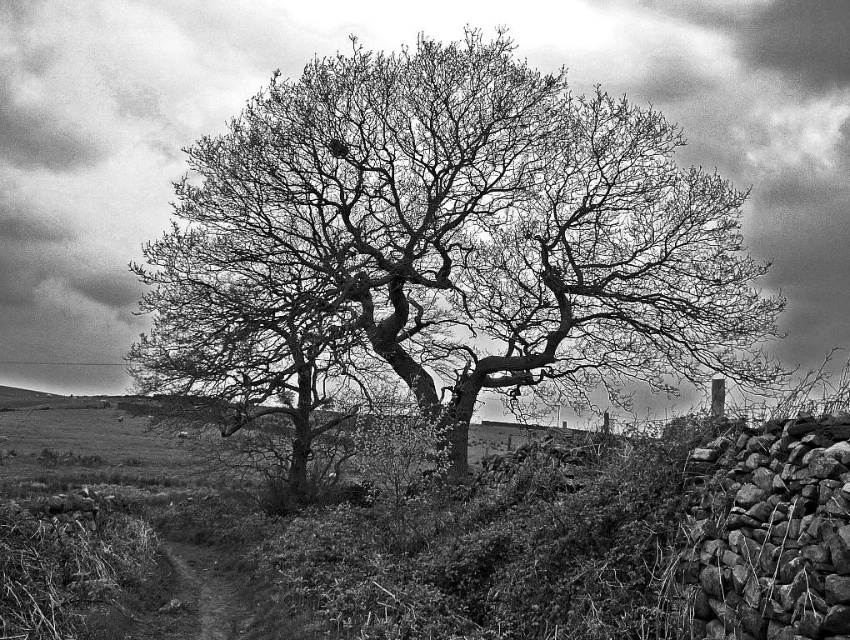
How much distance is there between bare branches at center and grassy hillside at center?

They are 4.12 meters apart.

Is the position of bare branches at center more distant than that of grassy hillside at center?

That is True.

The image size is (850, 640). Find the location of `bare branches at center`. bare branches at center is located at coordinates (446, 241).